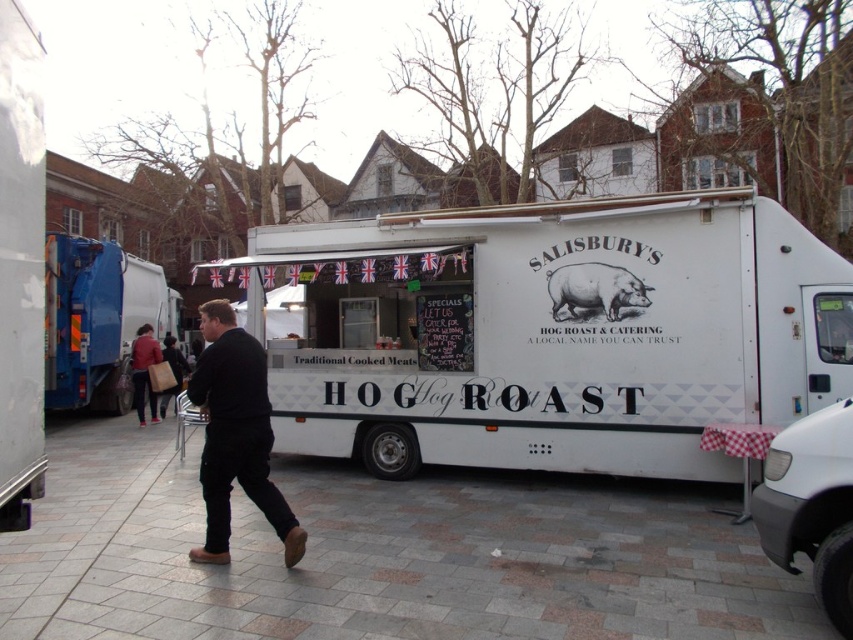
Question: Does gray concrete pavement at lower center appear under dark blue jeans at center?

Choices:
 (A) yes
 (B) no

Answer: (A)

Question: Estimate the real-world distances between objects in this image. Which object is closer to the blue metallic garbage truck at left?

Choices:
 (A) gray concrete pavement at lower center
 (B) matte red jacket at left
 (C) white matte food truck at center
 (D) matte white pig at center

Answer: (B)

Question: Which point appears farthest from the camera in this image?

Choices:
 (A) (215, 470)
 (B) (291, 365)
 (C) (126, 296)

Answer: (C)

Question: Is white matte food truck at center thinner than matte white pig at center?

Choices:
 (A) yes
 (B) no

Answer: (A)

Question: Among these objects, which one is nearest to the camera?

Choices:
 (A) dark blue jeans at center
 (B) black matte jacket at center
 (C) blue metallic garbage truck at left

Answer: (B)

Question: Does black matte jacket at center appear on the right side of matte white pig at center?

Choices:
 (A) no
 (B) yes

Answer: (A)